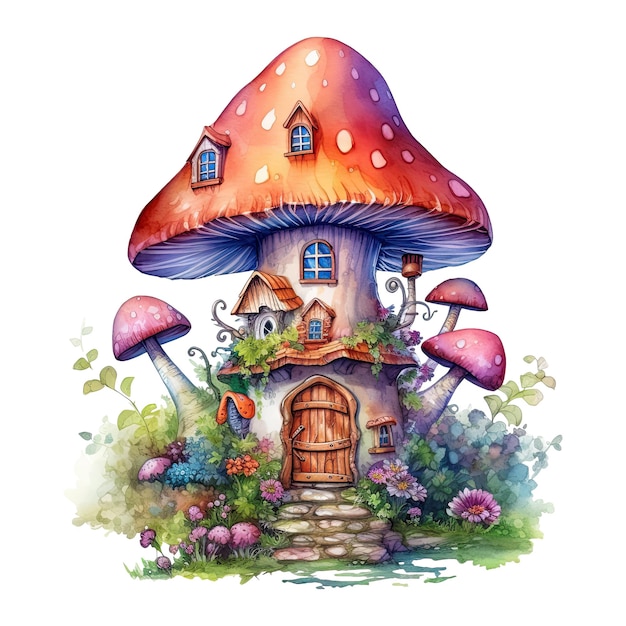
Find the location of a particular element. windows is located at coordinates (319, 257), (304, 134), (203, 166), (267, 324), (314, 327), (385, 438).